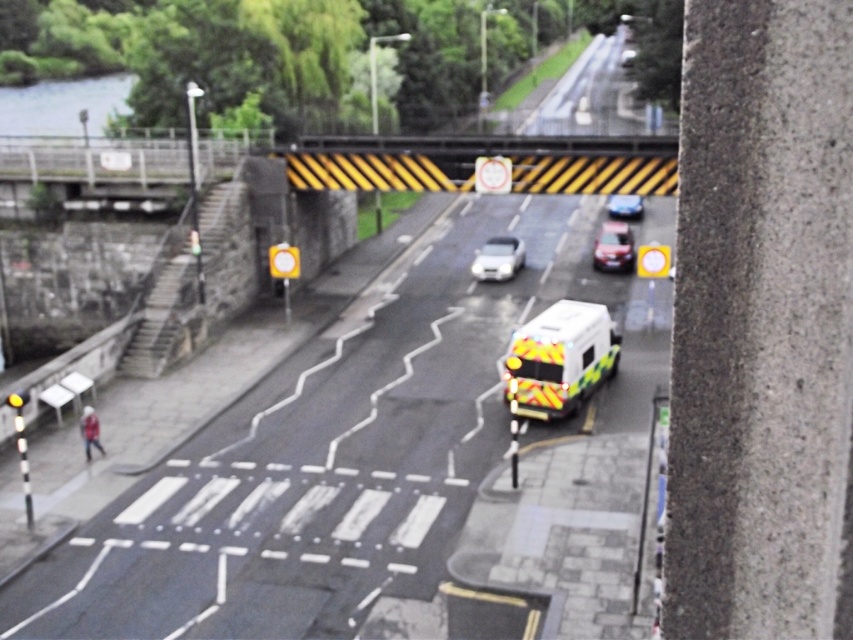
You are a pedestrian on the bridge looking down at the vehicles below. You see a white reflective van at center and a yellow reflective ambulance at center. Which vehicle is closer to you?

The white reflective van at center is closer to you because it is in front of the yellow reflective ambulance at center.

You are a delivery driver navigating through the street scene. You need to park your delivery van, which is the white glossy car at center, as close as possible to the bridge with yellow and black striped barrier without crossing the pedestrian crossing. Where should you position your van?

The white glossy car at center is already positioned at point (498, 259), which is the closest possible point to the bridge with yellow and black striped barrier without crossing the pedestrian crossing. Therefore, you should keep the van at its current location.

You are a delivery driver who needs to pass under the bridge with the yellow and black striped barrier. You are currently driving a white reflective van at center. There is also a white glossy car at center nearby. Which vehicle do you think might have difficulty passing under the bridge due to its height?

The white reflective van at center has a greater height compared to the white glossy car at center, so it might have difficulty passing under the bridge due to its height.